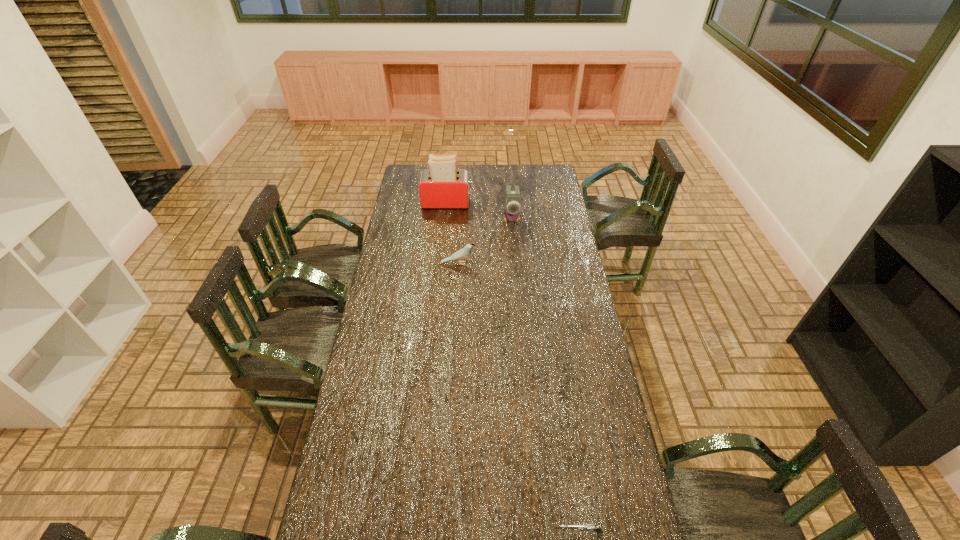
Identify the location of vacant space situated on the front-facing side of the nearest object. (509, 531).

Find the location of a particular element. vacant space located on the front-facing side of the nearest object is located at coordinates (468, 531).

You are a GUI agent. You are given a task and a screenshot of the screen. Output one action in this format:
    pyautogui.click(x=<x>, y=<y>)
    Task: Click on the free space located on the front-facing side of the nearest object
    The image size is (960, 540).
    Given the screenshot: What is the action you would take?
    pyautogui.click(x=477, y=531)

Identify the location of object positioned at the left edge. (442, 186).

Find the location of a particular element. The image size is (960, 540). object positioned at the right edge is located at coordinates (590, 527).

Identify the location of vacant region at the far edge of the desktop. This screenshot has height=540, width=960. (476, 186).

This screenshot has width=960, height=540. In the image, there is a desktop. In order to click on vacant space at the left edge in this screenshot , I will do `click(353, 413)`.

In the image, there is a desktop. Identify the location of vacant region at the right edge. (587, 431).

The image size is (960, 540). In order to click on free space between the right bird and the toaster in this screenshot , I will do `click(479, 211)`.

Find the location of a particular element. vacant space in between the tallest object and the second object from right to left is located at coordinates (479, 211).